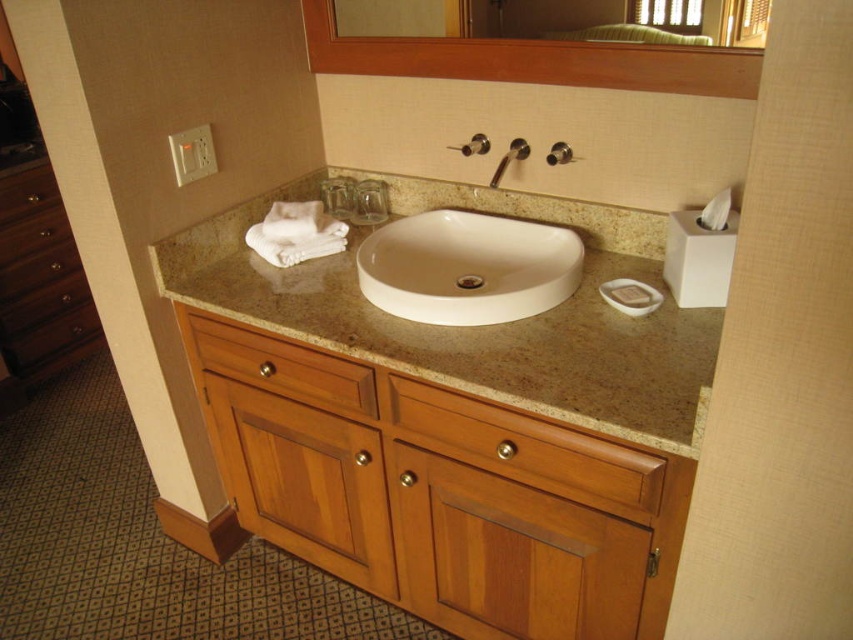
Question: Among these points, which one is nearest to the camera?

Choices:
 (A) (231, 209)
 (B) (730, 4)

Answer: (B)

Question: Does white ceramic sink at center have a greater width compared to wooden frame at upper center?

Choices:
 (A) no
 (B) yes

Answer: (A)

Question: Which point appears closest to the camera in this image?

Choices:
 (A) (693, 28)
 (B) (689, 276)

Answer: (A)

Question: Is wooden frame at upper center wider than wooden drawer at lower center?

Choices:
 (A) yes
 (B) no

Answer: (A)

Question: Which object is closer to the camera taking this photo?

Choices:
 (A) white ceramic sink at center
 (B) beige granite countertop at center
 (C) brown wood drawer at left
 (D) wooden drawer at center

Answer: (B)

Question: Can you confirm if wooden frame at upper center is positioned to the right of wooden drawer at center?

Choices:
 (A) yes
 (B) no

Answer: (A)